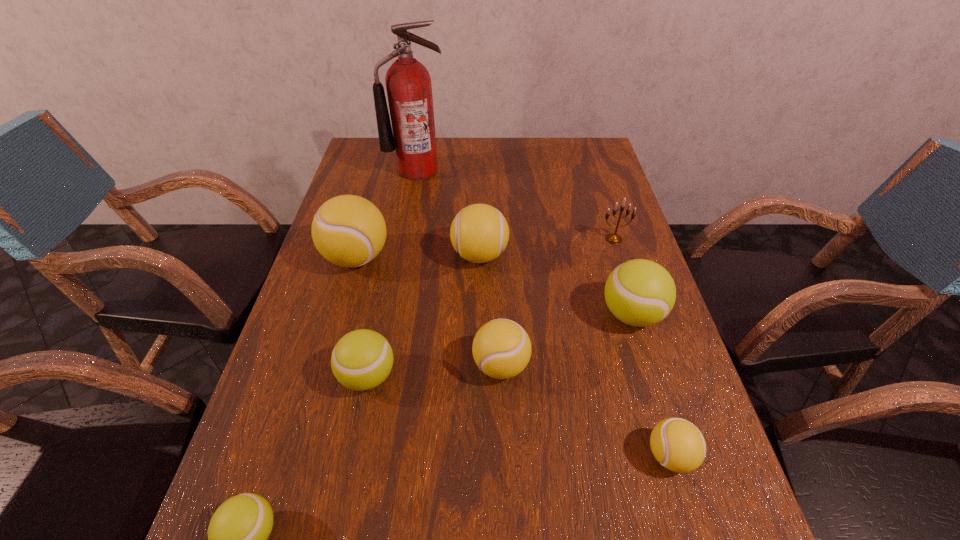
Select which green tennis ball appears as the second closest to the gold candelabrum. Please provide its 2D coordinates. Your answer should be formatted as a tuple, i.e. [(x, y)], where the tuple contains the x and y coordinates of a point satisfying the conditions above.

[(362, 359)]

Locate an element on the screen. This screenshot has height=540, width=960. green tennis ball identified as the second closest to the biggest yellow tennis ball is located at coordinates (639, 292).

Identify the location of free space that satisfies the following two spatial constraints: 1. on the front of the tallest object near the operation label; 2. on the right side of the third smallest yellow tennis ball. (402, 255).

Locate an element on the screen. The image size is (960, 540). vacant region that satisfies the following two spatial constraints: 1. on the back side of the third smallest yellow tennis ball; 2. on the right side of the candelabrum is located at coordinates (480, 239).

The image size is (960, 540). I want to click on free space that satisfies the following two spatial constraints: 1. on the back side of the candelabrum; 2. on the right side of the biggest yellow tennis ball, so click(x=362, y=239).

Where is `free space that satisfies the following two spatial constraints: 1. on the back side of the gold candelabrum; 2. on the left side of the fifth farthest object`? This screenshot has width=960, height=540. free space that satisfies the following two spatial constraints: 1. on the back side of the gold candelabrum; 2. on the left side of the fifth farthest object is located at coordinates (609, 239).

In order to click on vacant space that satisfies the following two spatial constraints: 1. on the front side of the eighth farthest object; 2. on the right side of the second nearest yellow tennis ball in this screenshot , I will do `click(504, 455)`.